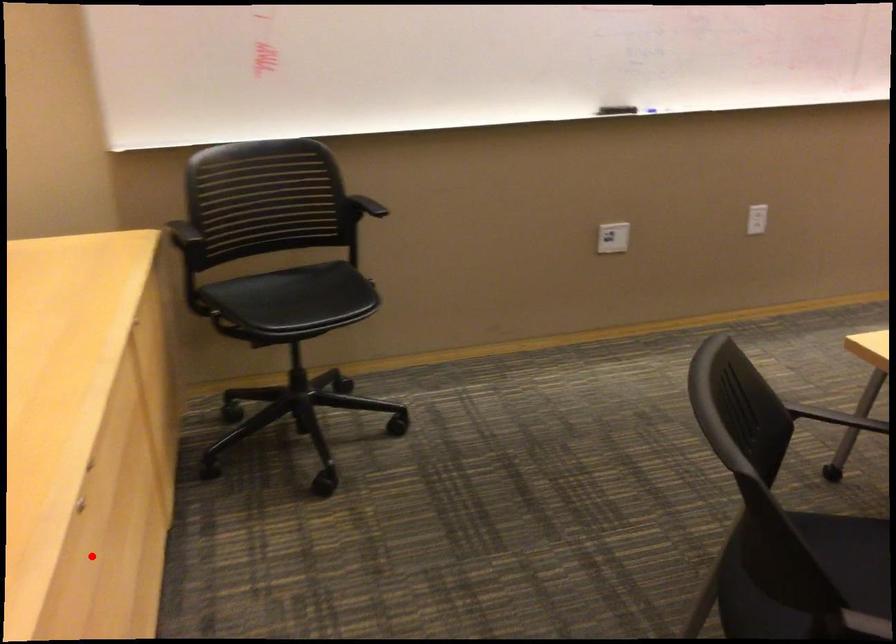
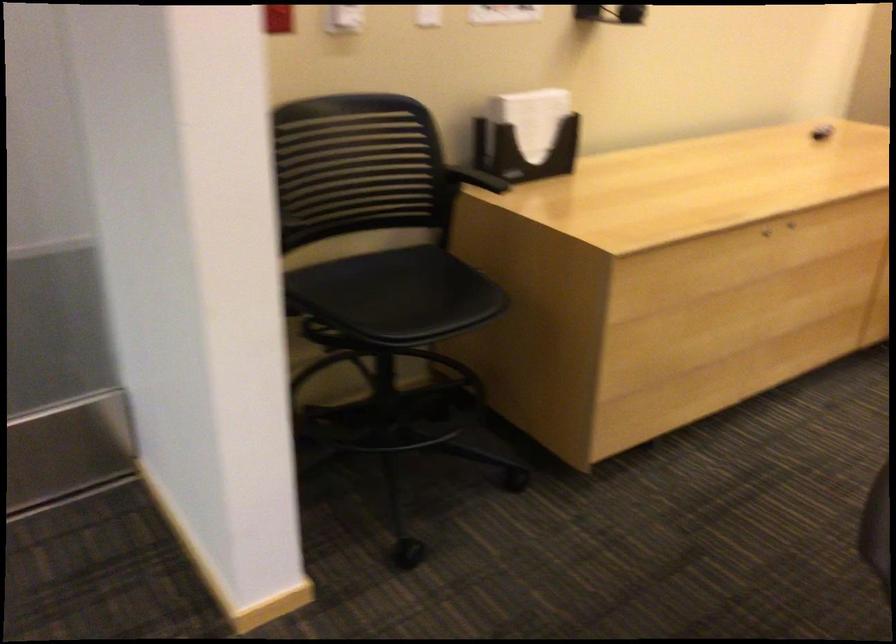
Question: I am providing you with two images of the same scene from different viewpoints. A red point is shown in image1. For the corresponding object point in image2, is it positioned nearer or farther from the camera?

Choices:
 (A) Nearer
 (B) Farther

Answer: (B)